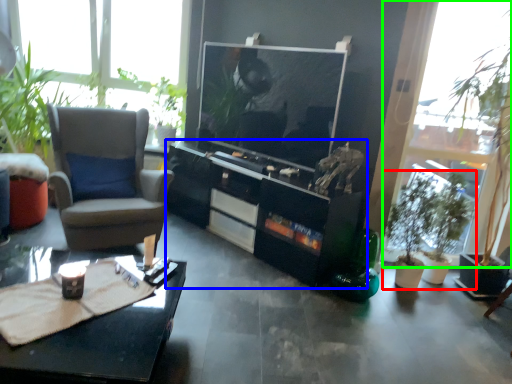
Question: Which object is the closest to the houseplant (highlighted by a red box)? Choose among these: cabinetry (highlighted by a blue box) or window (highlighted by a green box).

Choices:
 (A) cabinetry
 (B) window

Answer: (B)